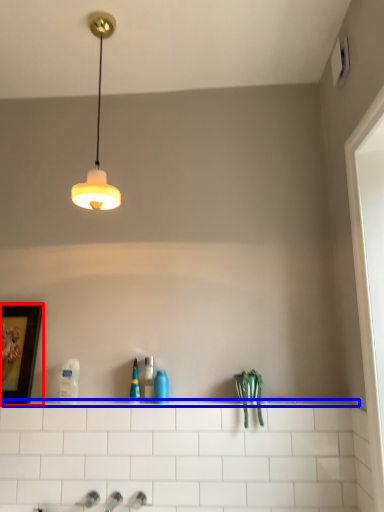
Question: Which of the following is the closest to the observer, picture frame (highlighted by a red box) or ledge (highlighted by a blue box)?

Choices:
 (A) picture frame
 (B) ledge

Answer: (B)